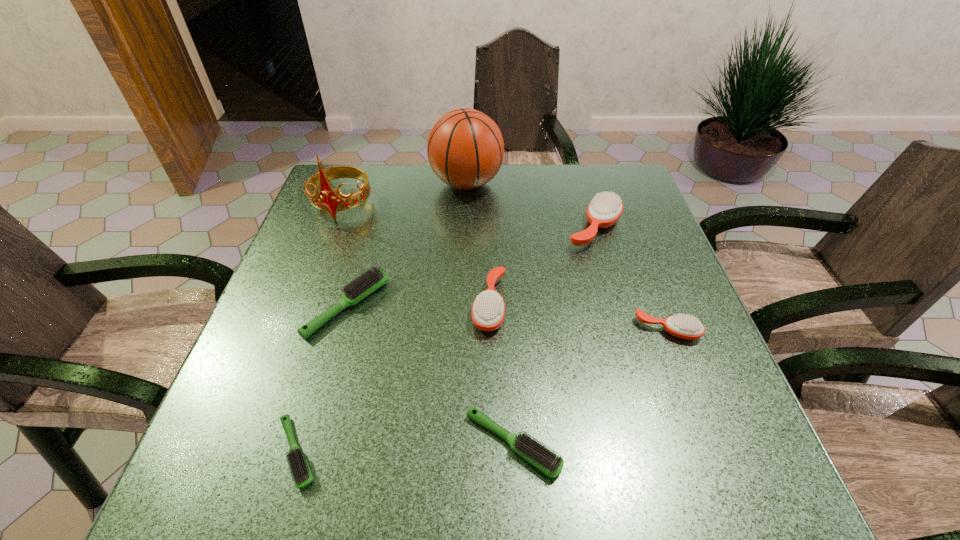
At what (x,y) coordinates should I click in order to perform the action: click on free spot that satisfies the following two spatial constraints: 1. on the front-facing side of the shortest object; 2. on the left side of the tiara. Please return your answer as a coordinate pair (x, y). Image resolution: width=960 pixels, height=540 pixels. Looking at the image, I should click on (250, 452).

Find the location of a particular element. The width and height of the screenshot is (960, 540). free space that satisfies the following two spatial constraints: 1. on the back side of the basketball; 2. on the right side of the shortest object is located at coordinates (376, 184).

At what (x,y) coordinates should I click in order to perform the action: click on free point that satisfies the following two spatial constraints: 1. on the front-facing side of the red tiara; 2. on the right side of the smallest orange hairbrush. Please return your answer as a coordinate pair (x, y). Looking at the image, I should click on (296, 330).

Locate an element on the screen. vacant region that satisfies the following two spatial constraints: 1. on the front-facing side of the red tiara; 2. on the left side of the rightmost light hairbrush is located at coordinates (252, 443).

The image size is (960, 540). I want to click on free spot that satisfies the following two spatial constraints: 1. on the back side of the second tallest hairbrush; 2. on the right side of the tallest hairbrush, so click(x=488, y=228).

Image resolution: width=960 pixels, height=540 pixels. I want to click on vacant region that satisfies the following two spatial constraints: 1. on the front side of the basketball; 2. on the right side of the leftmost orange hairbrush, so click(462, 305).

You are a GUI agent. You are given a task and a screenshot of the screen. Output one action in this format:
    pyautogui.click(x=<x>, y=<y>)
    Task: Click on the free space that satisfies the following two spatial constraints: 1. on the back side of the shortest object; 2. on the left side of the second shortest object
    This screenshot has height=540, width=960.
    Given the screenshot: What is the action you would take?
    pyautogui.click(x=300, y=443)

I want to click on vacant region that satisfies the following two spatial constraints: 1. on the front-facing side of the tiara; 2. on the right side of the farthest light hairbrush, so click(x=304, y=307).